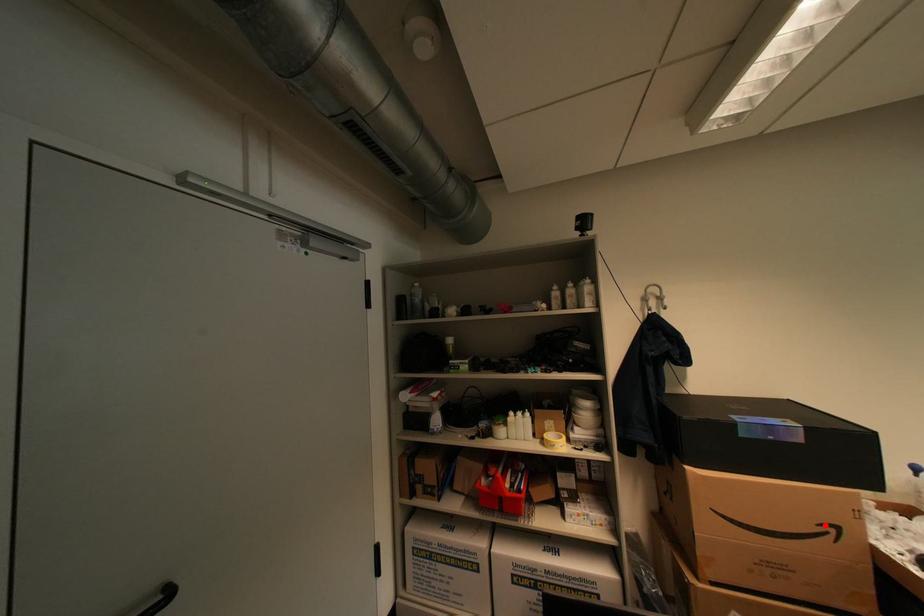
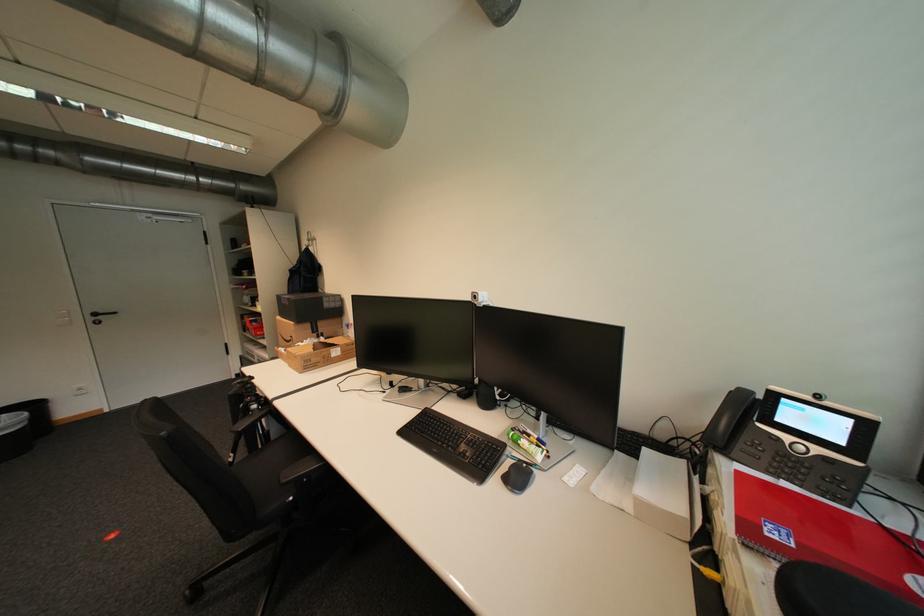
The point at the highlighted location is marked in the first image. Where is the corresponding point in the second image?

(299, 338)